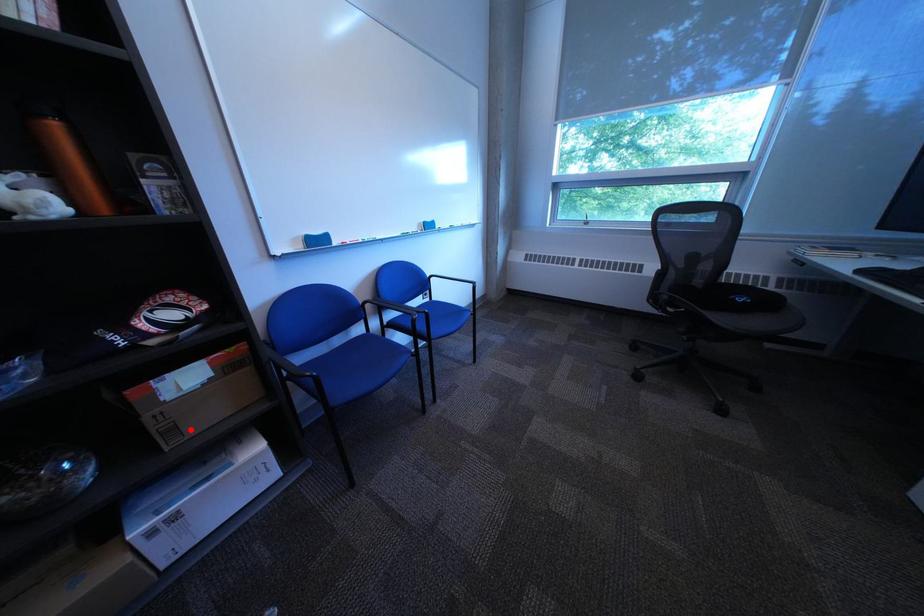
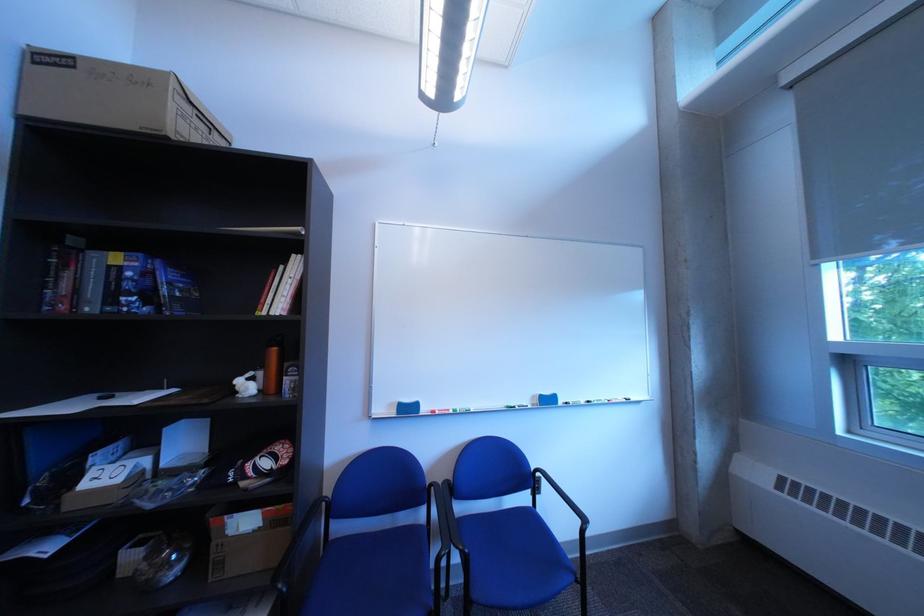
The point at the highlighted location is marked in the first image. Where is the corresponding point in the second image?

(237, 565)